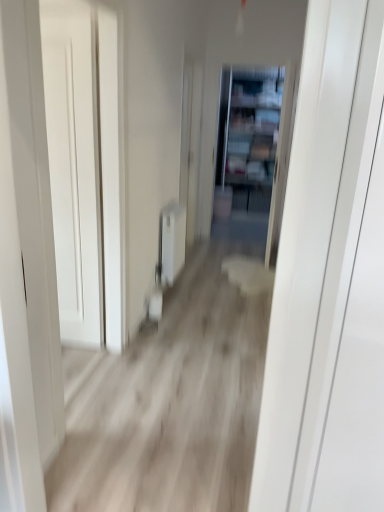
Question: Does clear glass bookshelf at center lie behind white smooth door at left?

Choices:
 (A) yes
 (B) no

Answer: (A)

Question: Is clear glass bookshelf at center positioned in front of white smooth door at left?

Choices:
 (A) no
 (B) yes

Answer: (A)

Question: Does clear glass bookshelf at center have a greater height compared to white smooth door at left?

Choices:
 (A) yes
 (B) no

Answer: (A)

Question: Would you say clear glass bookshelf at center is a long distance from white smooth door at left?

Choices:
 (A) no
 (B) yes

Answer: (B)

Question: Is clear glass bookshelf at center oriented towards white smooth door at left?

Choices:
 (A) no
 (B) yes

Answer: (B)

Question: Looking at their shapes, would you say clear glass bookshelf at center is wider or thinner than white smooth door at left?

Choices:
 (A) wide
 (B) thin

Answer: (A)

Question: From a real-world perspective, is clear glass bookshelf at center physically located above or below white smooth door at left?

Choices:
 (A) below
 (B) above

Answer: (B)

Question: In the image, is clear glass bookshelf at center on the left side or the right side of white smooth door at left?

Choices:
 (A) left
 (B) right

Answer: (B)

Question: In terms of size, does clear glass bookshelf at center appear bigger or smaller than white smooth door at left?

Choices:
 (A) big
 (B) small

Answer: (A)

Question: Considering the positions of clear glass bookshelf at center and wooden floor at center in the image, is clear glass bookshelf at center taller or shorter than wooden floor at center?

Choices:
 (A) short
 (B) tall

Answer: (B)

Question: From a real-world perspective, is clear glass bookshelf at center physically located above or below wooden floor at center?

Choices:
 (A) above
 (B) below

Answer: (A)

Question: In terms of size, does clear glass bookshelf at center appear bigger or smaller than wooden floor at center?

Choices:
 (A) big
 (B) small

Answer: (B)

Question: Looking at their shapes, would you say clear glass bookshelf at center is wider or thinner than wooden floor at center?

Choices:
 (A) wide
 (B) thin

Answer: (B)

Question: From their relative heights in the image, would you say white smooth door at left is taller or shorter than wooden floor at center?

Choices:
 (A) tall
 (B) short

Answer: (A)

Question: Considering the positions of white smooth door at left and wooden floor at center in the image, is white smooth door at left bigger or smaller than wooden floor at center?

Choices:
 (A) small
 (B) big

Answer: (A)